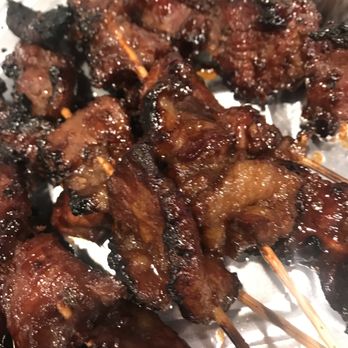
At what (x,y) coordinates should I click in order to perform the action: click on crumb. Please return your answer as a coordinate pair (x, y). Looking at the image, I should click on (3, 50).